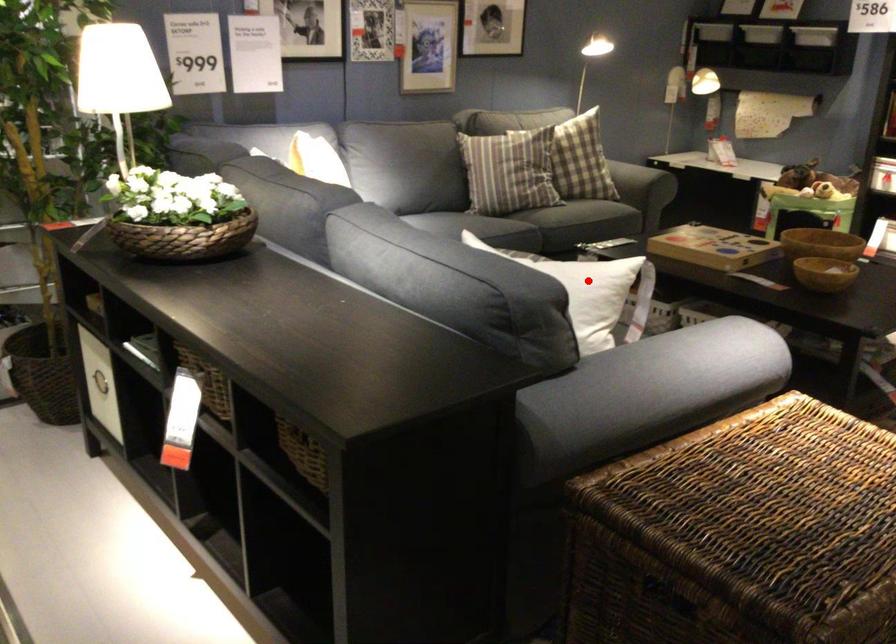
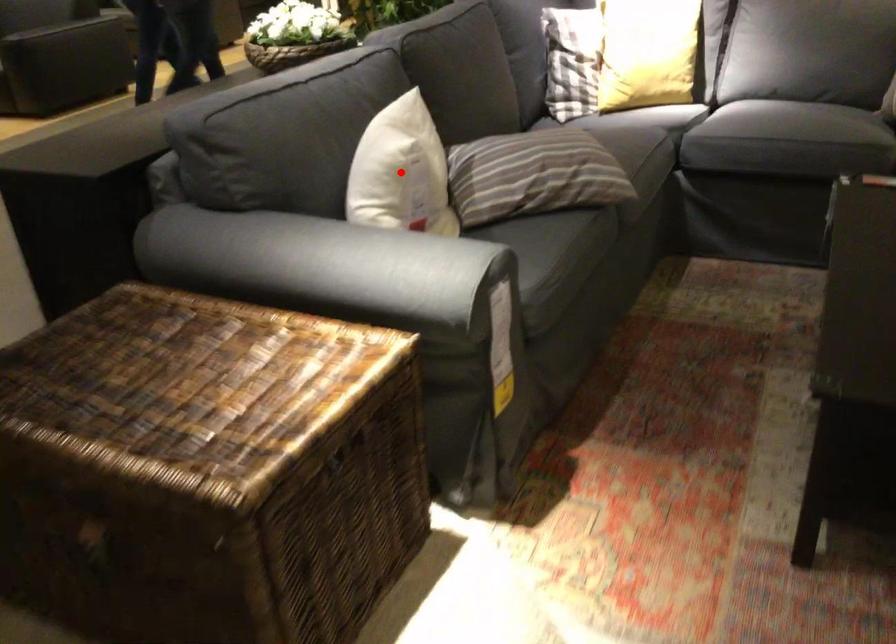
I am providing you with two images of the same scene from different viewpoints. A red point is marked on the first image and another point is marked on the second image. Does the point marked in image1 correspond to the same location as the one in image2?

Yes